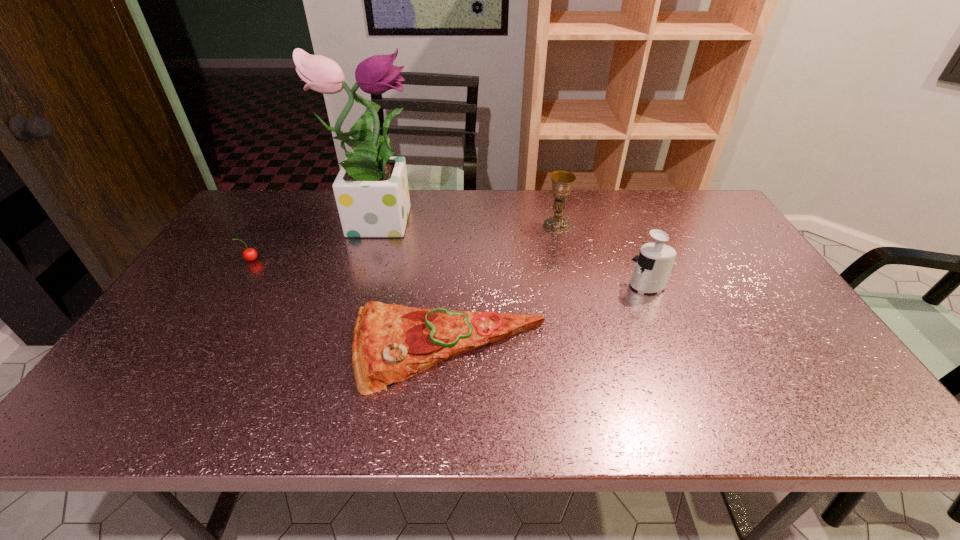
The height and width of the screenshot is (540, 960). I want to click on the tallest object, so [x=371, y=190].

The image size is (960, 540). What are the coordinates of `the second object from right to left` in the screenshot? It's located at (562, 181).

Find the location of a particular element. the rightmost object is located at coordinates (653, 266).

This screenshot has height=540, width=960. I want to click on the fourth farthest object, so [x=653, y=266].

Find the location of a particular element. cherry is located at coordinates (250, 254).

Locate an element on the screen. This screenshot has width=960, height=540. the second shortest object is located at coordinates (250, 254).

The image size is (960, 540). What are the coordinates of `the shortest object` in the screenshot? It's located at (391, 343).

You are a GUI agent. You are given a task and a screenshot of the screen. Output one action in this format:
    pyautogui.click(x=<x>, y=<y>)
    Task: Click on the pizza
    The image size is (960, 540).
    Given the screenshot: What is the action you would take?
    pyautogui.click(x=391, y=343)

The height and width of the screenshot is (540, 960). Identify the location of free space located on the front-facing side of the flower arrangement. [x=448, y=218].

The width and height of the screenshot is (960, 540). In order to click on free space located 0.140m on the front of the chalice in this screenshot , I will do `click(564, 261)`.